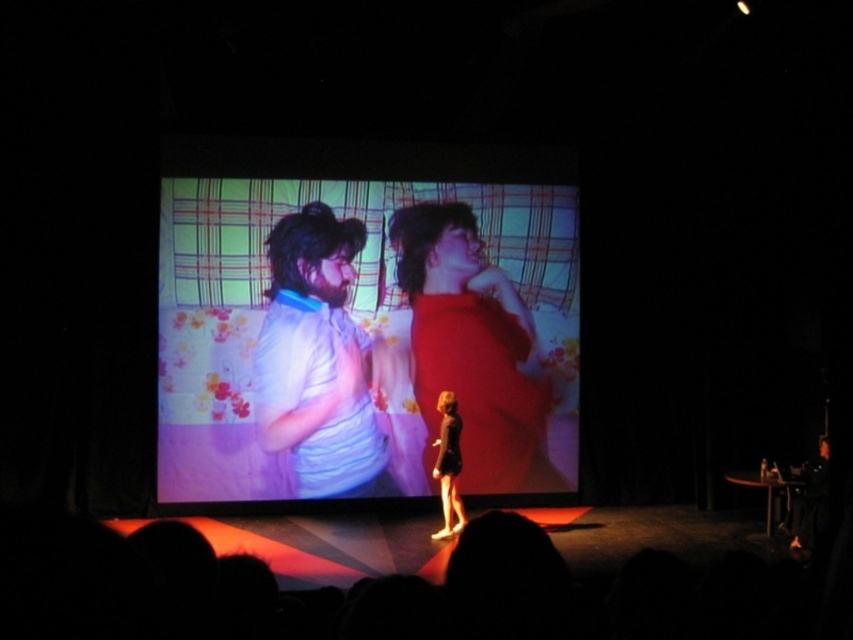
You are an audience member sitting in the front row of the theater. You notice two points on the stage. The first point is at coordinates point (502, 300) and the second point is at point (335, 410). Which point is closer to you?

Point (502, 300) is closer to you because it is further to the viewer than point (335, 410).

You are part of the stage crew and need to ensure that the light blue fabric shirt at center and the black satin dress at center fit within a 1.2 meter wide backdrop. Given their sizes, will both items fit side by side horizontally?

The light blue fabric shirt at center has a larger width than the black satin dress at center. However, since the total width required for both items side by side is not provided, it is impossible to determine if they will fit within the 1.2 meter backdrop. Additional measurements are needed.